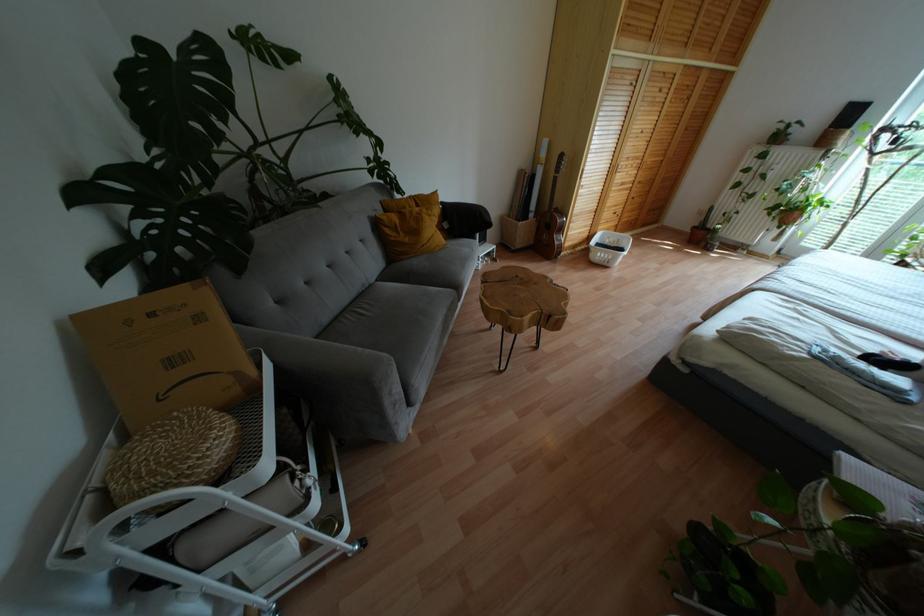
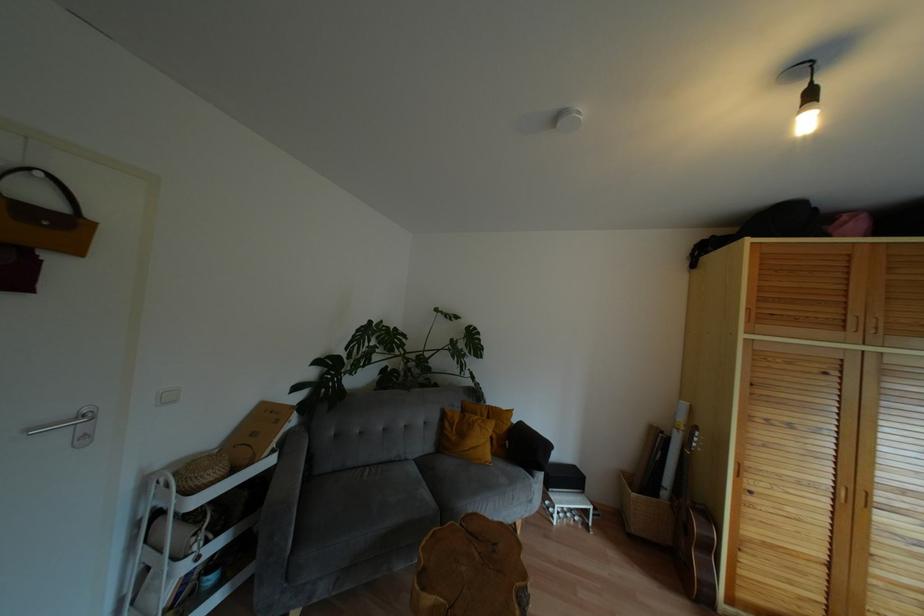
In the second image, find the point that corresponds to point 443,240 in the first image.

(488, 456)